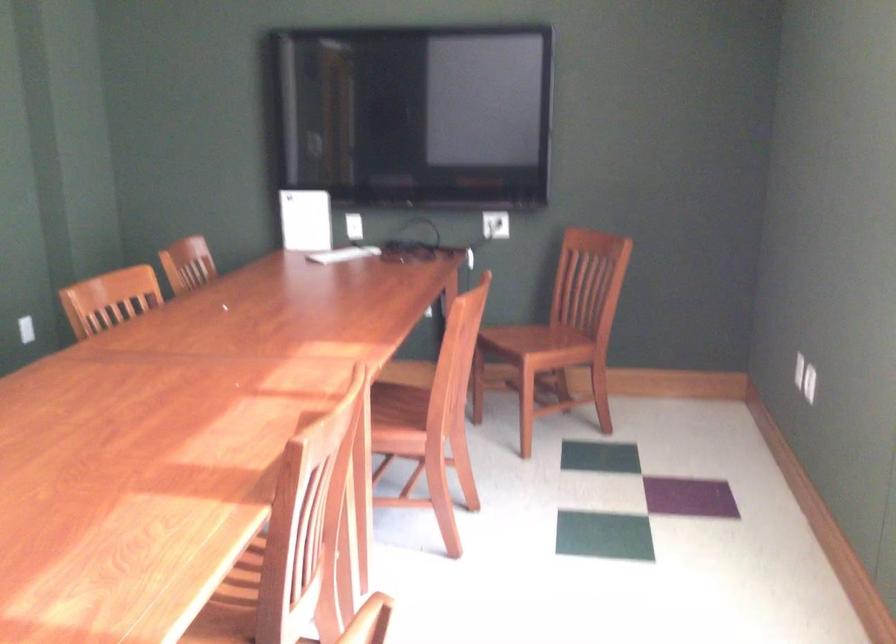
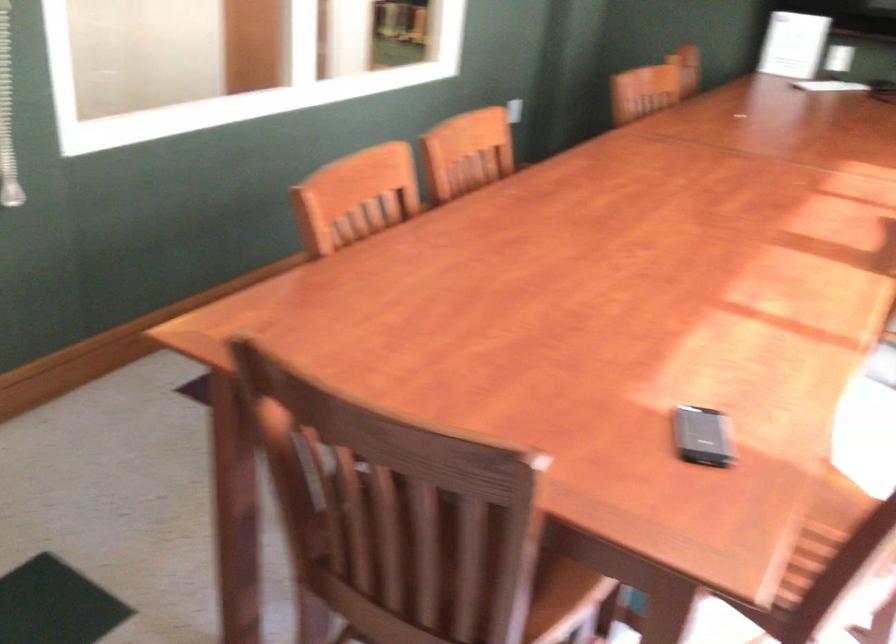
What movement of the cameraman would produce the second image?

The cameraman moved toward left, backward.